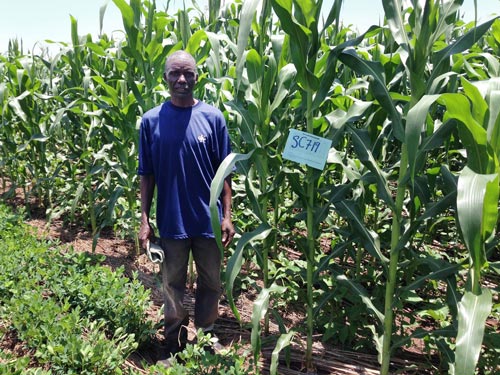
This screenshot has height=375, width=500. What are the coordinates of `smaller plants` in the screenshot? It's located at (116, 299), (65, 334), (24, 252), (235, 365).